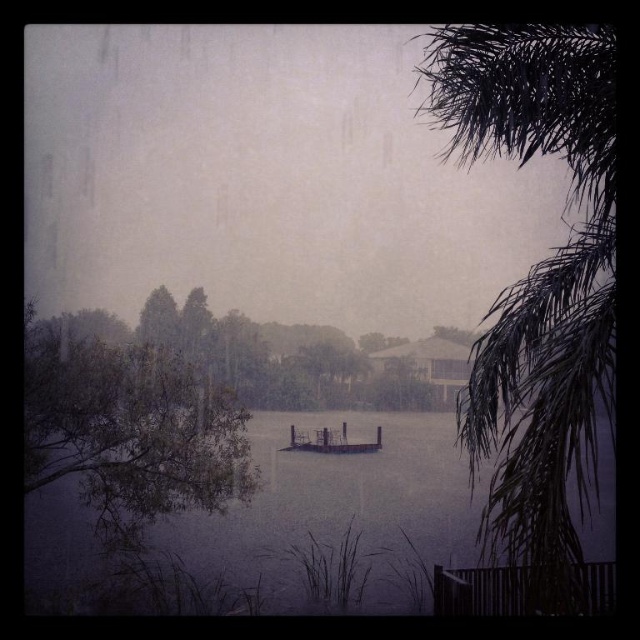
Question: Which point is closer to the camera?

Choices:
 (A) (328, 429)
 (B) (420, 496)
 (C) (602, 232)

Answer: (C)

Question: Which point appears farthest from the camera in this image?

Choices:
 (A) (586, 97)
 (B) (452, 484)
 (C) (241, 342)

Answer: (C)

Question: Does dark green leafy palm tree at right appear over wooden dock at center?

Choices:
 (A) no
 (B) yes

Answer: (B)

Question: Can you confirm if dark green leafy palm tree at right is thinner than green leafy tree at center?

Choices:
 (A) yes
 (B) no

Answer: (A)

Question: Which point is closer to the camera taking this photo?

Choices:
 (A) (144, 353)
 (B) (406, 589)
 (C) (380, 442)
 (D) (550, 433)

Answer: (D)

Question: Is green matte tree at left to the left of green leafy tree at center from the viewer's perspective?

Choices:
 (A) yes
 (B) no

Answer: (A)